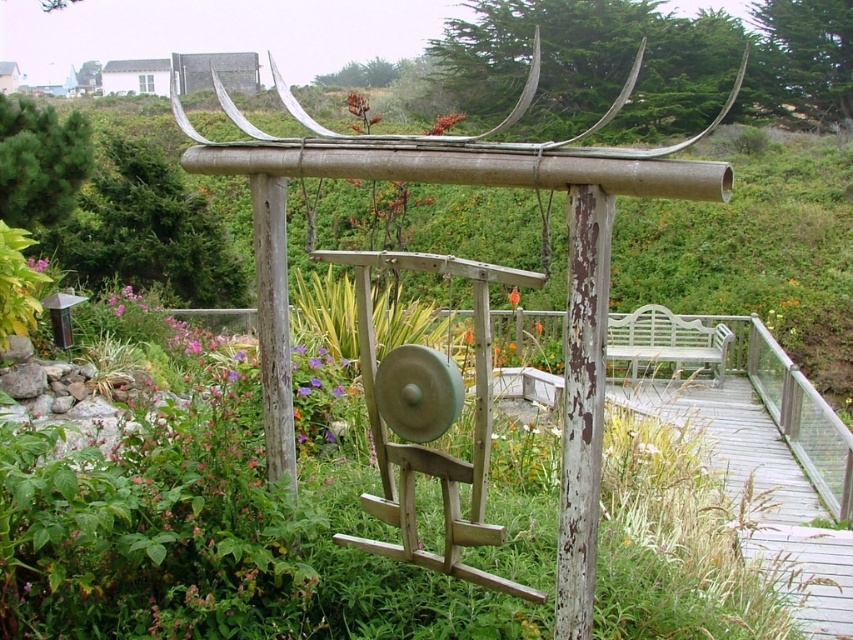
Consider the image. You are standing in the garden and want to touch both the wooden gong at center and the purple matte flower at center. Which object should you reach for first to touch the one closer to you?

The wooden gong at center is closer to the viewer than the purple matte flower at center, so you should reach for the wooden gong at center first.

You are planning to place a new flower pot between the orange matte flower at center and the purple matte flower at center in the garden. The flower pot is 3 feet wide. Is there enough space between them to place the pot without moving the existing flowers?

The distance between the orange matte flower at center and the purple matte flower at center is 22.99 feet. Since the flower pot is only 3 feet wide, there is ample space to place it between them without needing to move the existing flowers.

You are standing in the garden and want to place a small potted plant between the two points, point (376, 540) and point (512, 296). Which point should the plant be closer to in order to be positioned in front of the gong stand?

The plant should be closer to point (376, 540) because it is in front of point (512, 296), so placing it near the front point would position it in front of the gong stand.